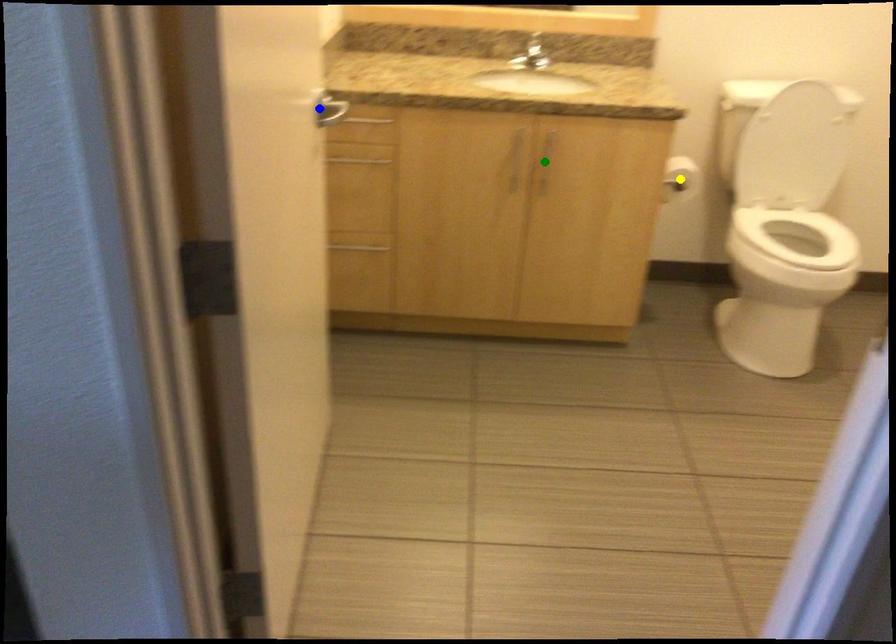
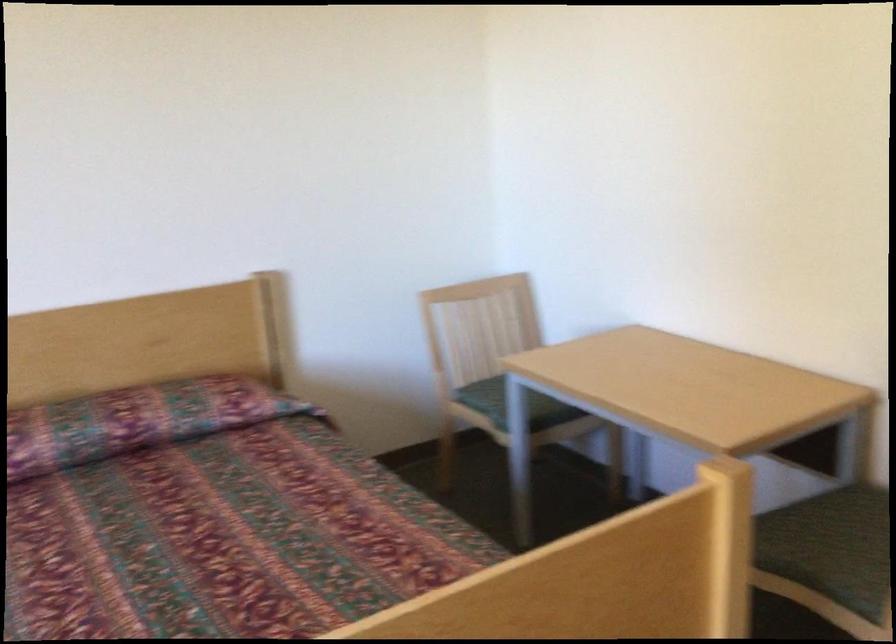
I am providing you with two images of the same scene from different viewpoints. Three points are marked in image1. Which point corresponds to a part or object that is occluded in image2?In image1, three points are marked. Which of them correspond to a part or object that is occluded in image2?Among the three points shown in image1, which one corresponds to a part or object that is no longer visible due to occlusion in image2?

yellow point, green point, blue point